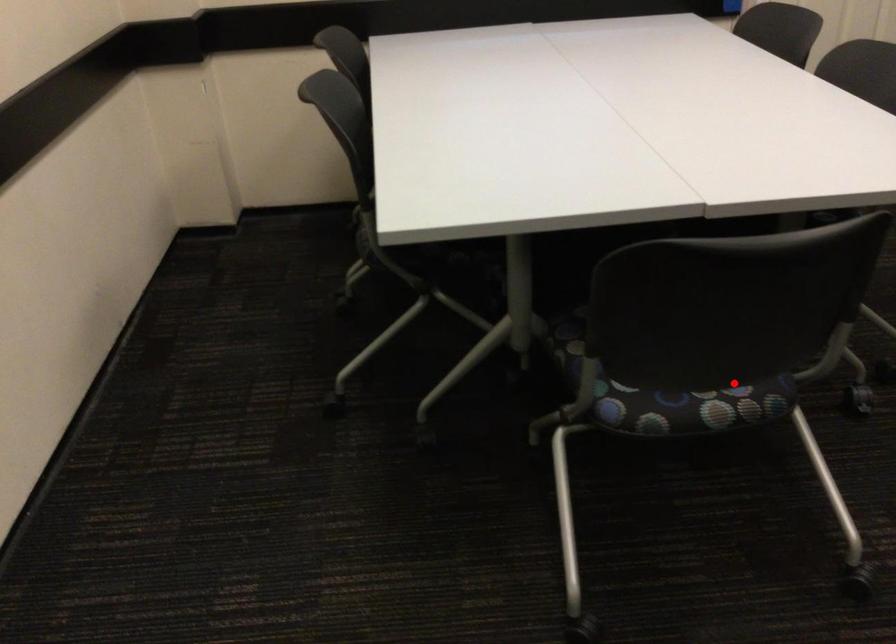
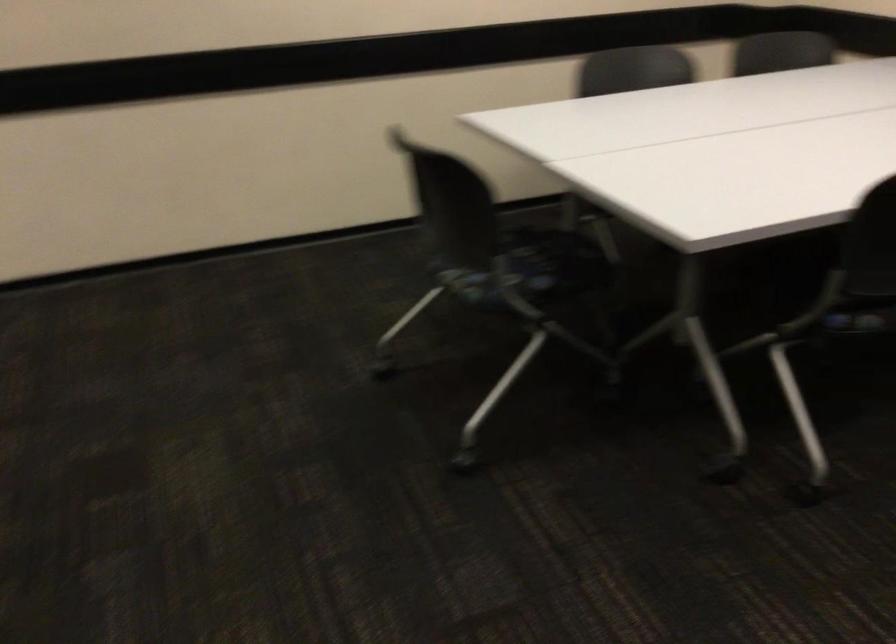
Locate, in the second image, the point that corresponds to the highlighted location in the first image.

(494, 285)